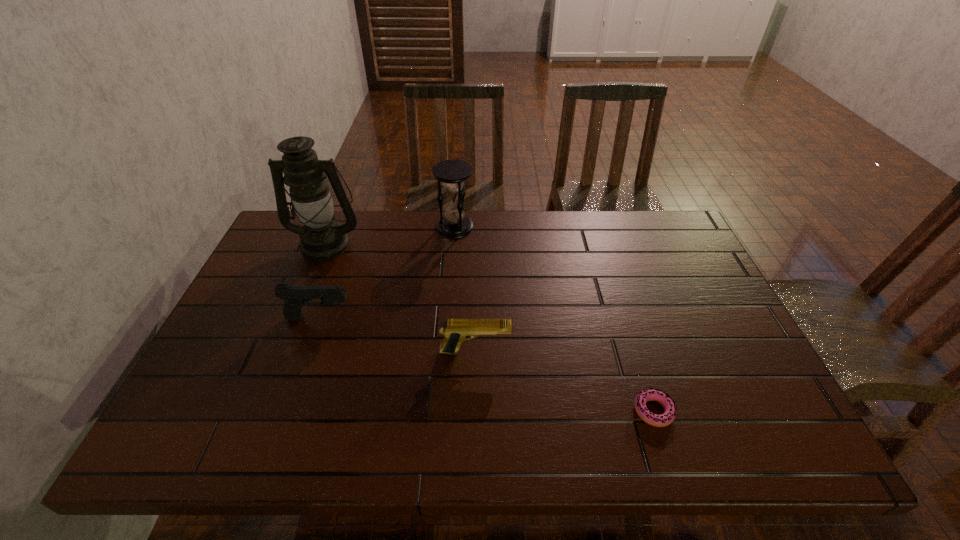
Where is `vacant space situated at the barrel of the farther pistol`? The height and width of the screenshot is (540, 960). vacant space situated at the barrel of the farther pistol is located at coordinates (463, 318).

Find the location of a particular element. The height and width of the screenshot is (540, 960). blank space located 0.350m at the barrel of the nearer pistol is located at coordinates (654, 352).

Where is `free space located 0.300m on the back of the shortest object`? The image size is (960, 540). free space located 0.300m on the back of the shortest object is located at coordinates (618, 299).

Identify the location of oil lamp at the far edge. The image size is (960, 540). (322, 237).

In order to click on hourglass that is at the far edge in this screenshot , I will do `click(452, 173)`.

Locate an element on the screen. The image size is (960, 540). object located in the near edge section of the desktop is located at coordinates (664, 399).

The image size is (960, 540). Identify the location of oil lamp present at the left edge. (322, 237).

Where is `pistol that is positioned at the left edge`? This screenshot has width=960, height=540. pistol that is positioned at the left edge is located at coordinates coord(295,297).

This screenshot has height=540, width=960. I want to click on object present at the far left corner, so click(322, 237).

Identify the location of vacant space at the far edge of the desktop. This screenshot has height=540, width=960. (447, 243).